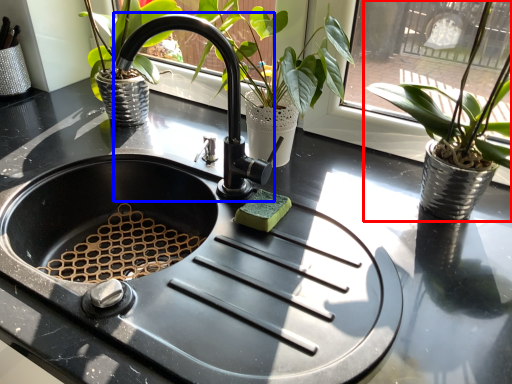
Question: Which of the following is the closest to the observer, houseplant (highlighted by a red box) or faucet (highlighted by a blue box)?

Choices:
 (A) houseplant
 (B) faucet

Answer: (A)